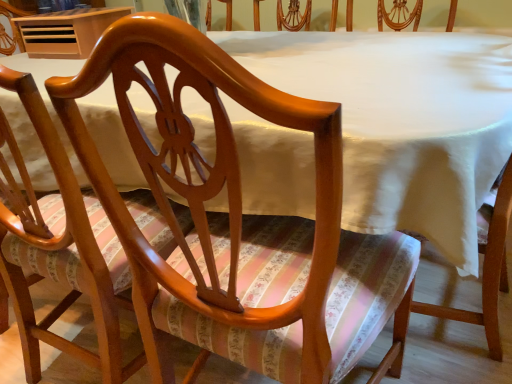
Question: From their relative heights in the image, would you say glossy wood chair at center, arranged as the 2th chair when viewed from the right, is taller or shorter than wooden table at upper left?

Choices:
 (A) tall
 (B) short

Answer: (A)

Question: In terms of width, does glossy wood chair at center, placed as the 1th chair when sorted from left to right, look wider or thinner when compared to wooden table at upper left?

Choices:
 (A) thin
 (B) wide

Answer: (B)

Question: Which object is positioned closest to the wooden table at upper left?

Choices:
 (A) glossy wood chair at center, arranged as the 2th chair when viewed from the right
 (B) glossy wood chair at center, the 2th chair in the left-to-right sequence

Answer: (A)

Question: Based on their relative distances, which object is nearer to the glossy wood chair at center, the 2th chair in the left-to-right sequence?

Choices:
 (A) glossy wood chair at center, arranged as the 2th chair when viewed from the right
 (B) wooden table at upper left

Answer: (A)